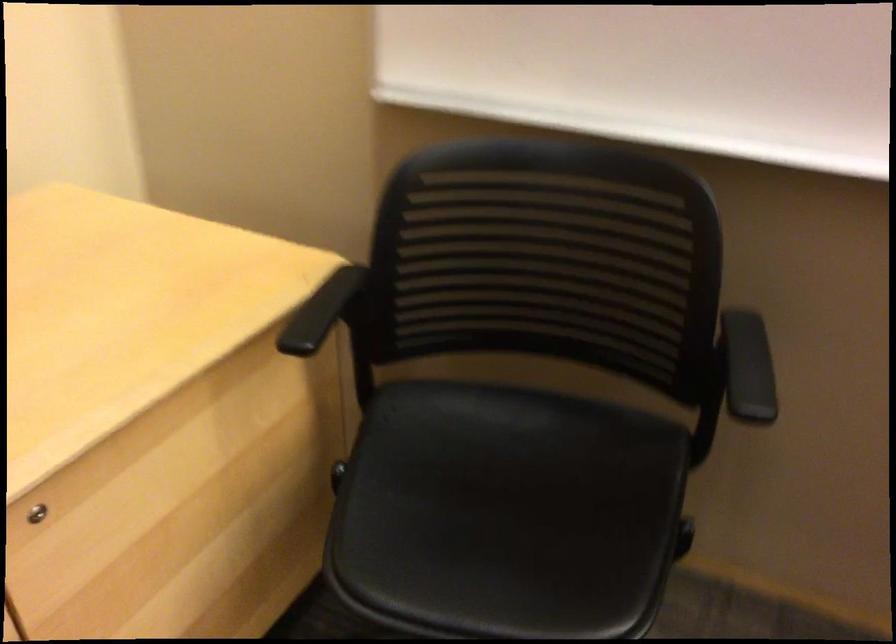
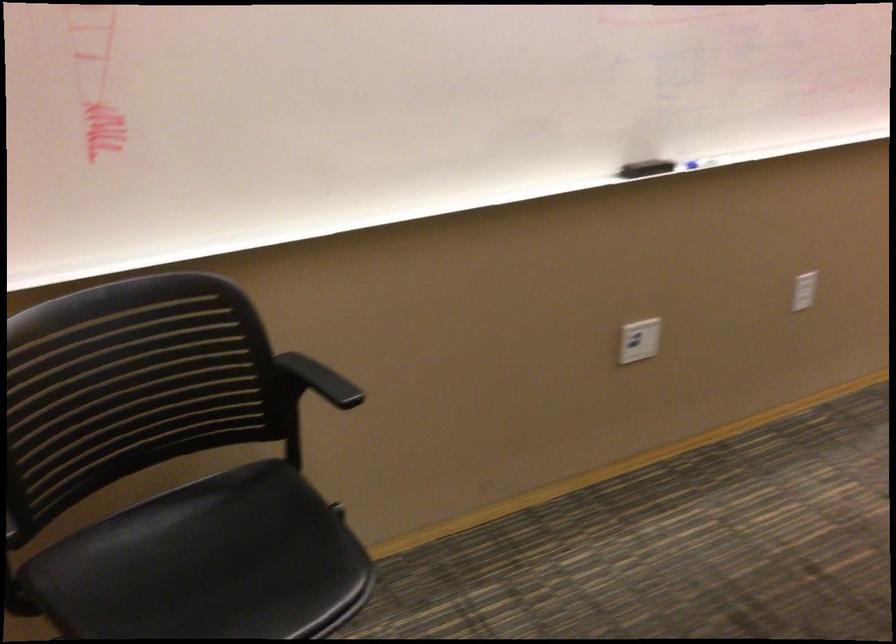
Question: The images are taken continuously from a first-person perspective. In which direction is your viewpoint rotating?

Choices:
 (A) Left
 (B) Right
 (C) Up
 (D) Down

Answer: (B)